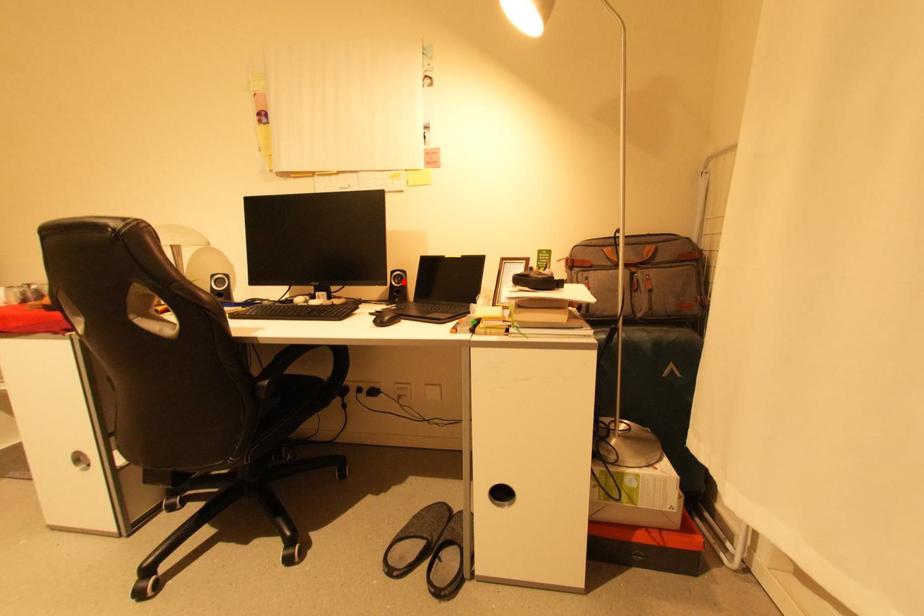
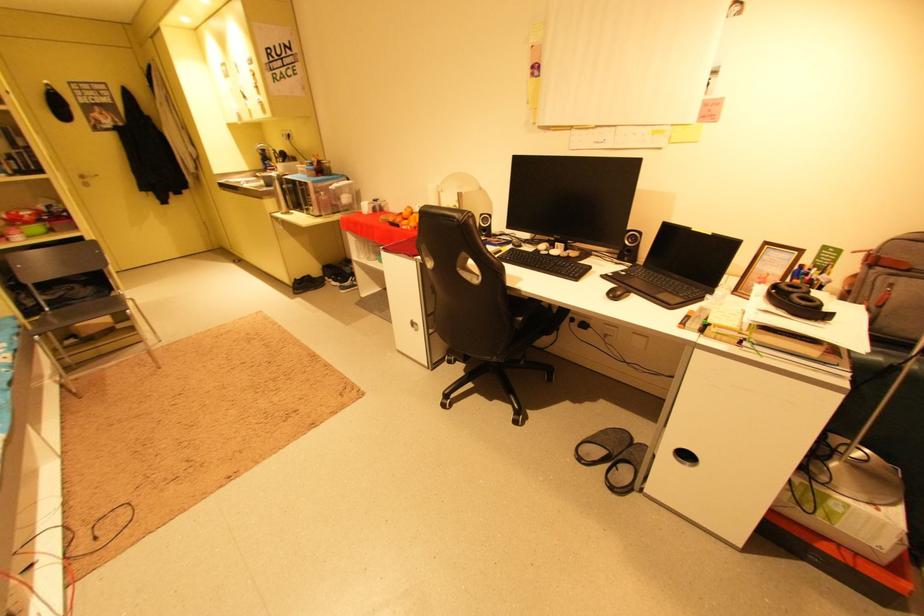
Find the pixel in the second image that matches the highlighted location in the first image.

(638, 241)